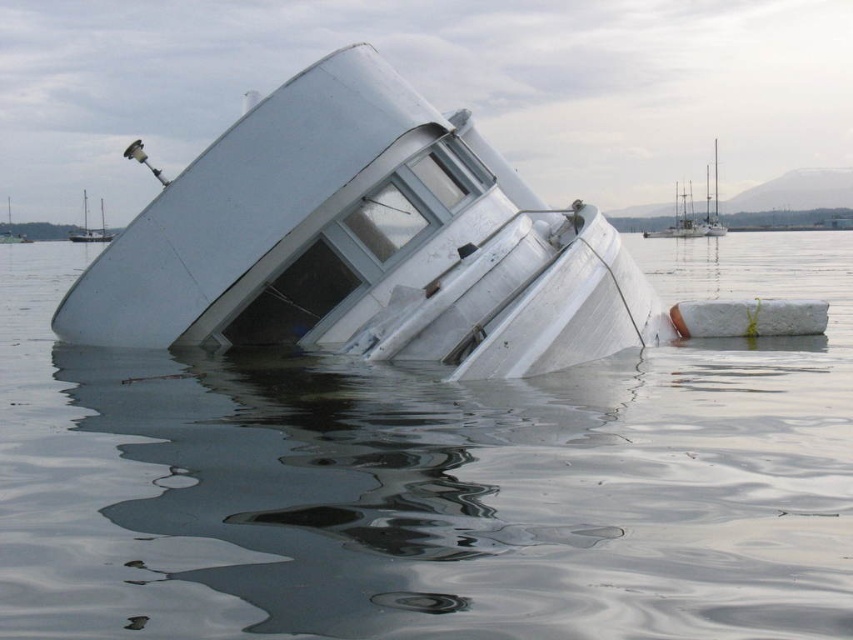
You are a photographer trying to capture both the white matte boat at upper right and the white glossy boat at center in a single shot. Given their sizes, which boat should you focus on to ensure both are visible without zooming in or out?

Since the white matte boat at upper right is larger than the white glossy boat at center, you should focus on the white glossy boat at center to ensure both are visible without needing to adjust the zoom. By framing the shot to include the smaller boat centrally, the larger one at the upper right will naturally fit within the same frame.

You are a photographer trying to capture the tilted structure in the image. You notice two points marked on the structure at coordinates point (705, 182) and point (7, 237). Which point will appear larger in your photo?

Point (705, 182) is closer to the camera than point (7, 237), so it will appear larger in the photo.